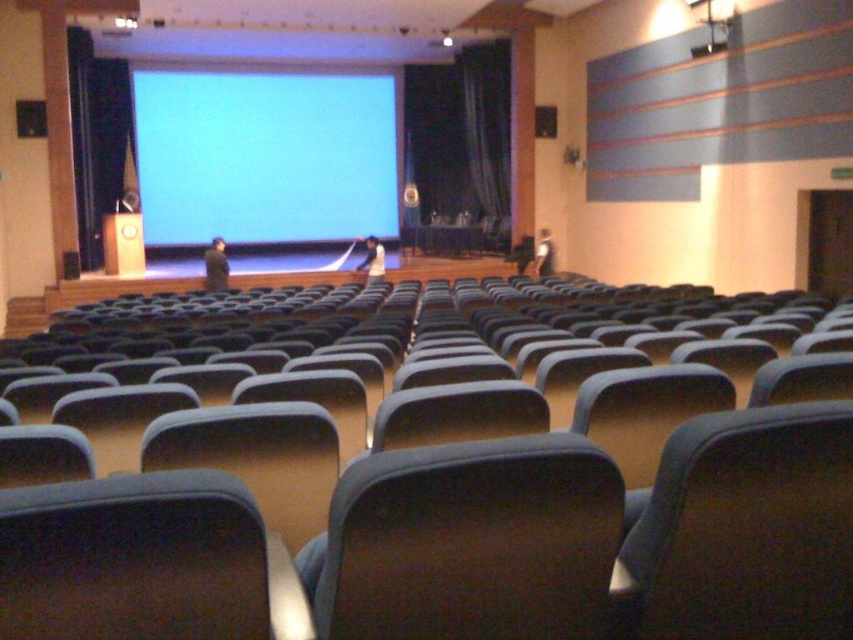
Can you confirm if blue fabric chair at center is shorter than blue fabric curtain at center?

Indeed, blue fabric chair at center has a lesser height compared to blue fabric curtain at center.

Can you confirm if blue fabric chair at center is wider than blue fabric curtain at center?

Correct, the width of blue fabric chair at center exceeds that of blue fabric curtain at center.

Identify the location of blue fabric chair at center. (445, 502).

Between blue matte projection screen at center and blue fabric curtain at center, which one is positioned lower?

blue fabric curtain at center is below.

This screenshot has height=640, width=853. Describe the element at coordinates (264, 156) in the screenshot. I see `blue matte projection screen at center` at that location.

The image size is (853, 640). I want to click on blue matte projection screen at center, so click(x=264, y=156).

Is dark fabric chair at center below dark fabric chair at lower right?

No, dark fabric chair at center is not below dark fabric chair at lower right.

Between dark fabric chair at center and dark fabric chair at lower right, which one has less height?

With less height is dark fabric chair at center.

You are a GUI agent. You are given a task and a screenshot of the screen. Output one action in this format:
    pyautogui.click(x=<x>, y=<y>)
    Task: Click on the dark fabric chair at center
    The height and width of the screenshot is (640, 853).
    Given the screenshot: What is the action you would take?
    pyautogui.click(x=471, y=541)

The image size is (853, 640). Identify the location of dark fabric chair at center. (471, 541).